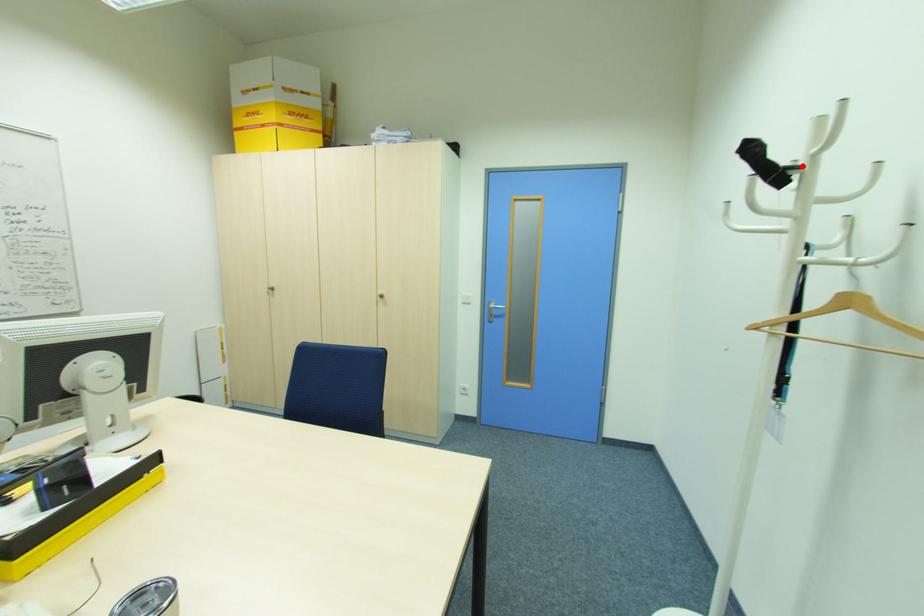
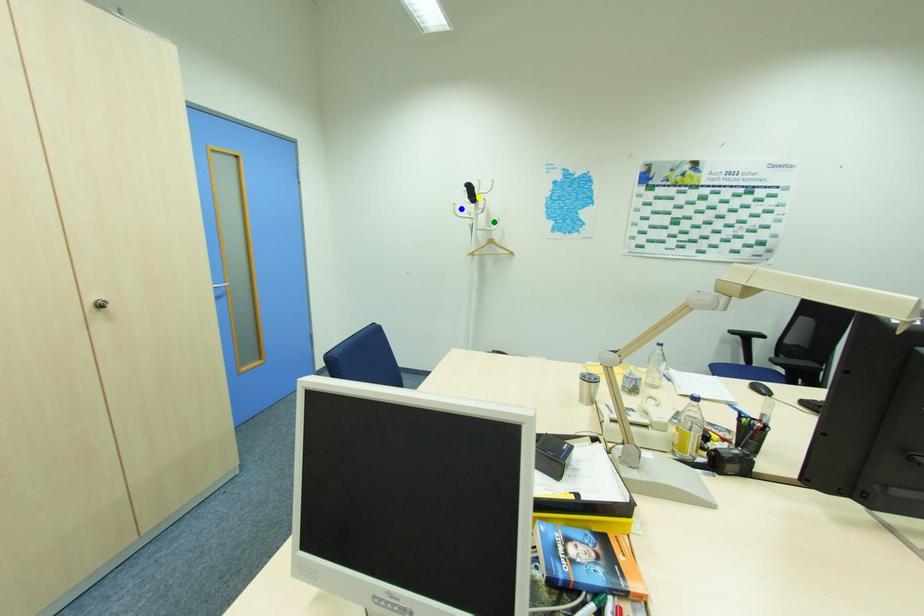
Question: I am providing you with two images of the same scene from different viewpoints. A red point is marked on the first image. You are given multiple points on the second image. Which point in image 2 represents the same 3d spot as the red point in image 1?

Choices:
 (A) yellow point
 (B) blue point
 (C) green point

Answer: (A)